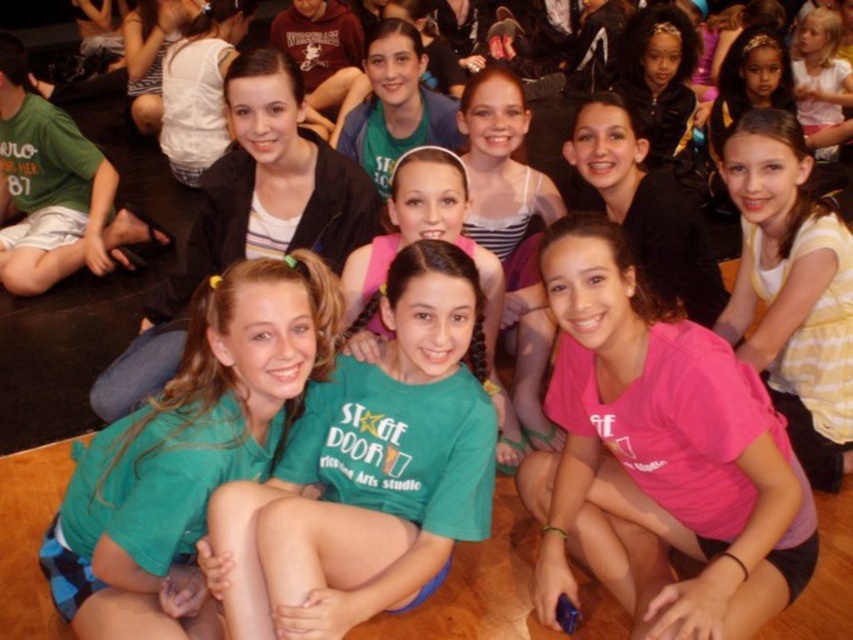
Question: Considering the real-world distances, which object is farthest from the pink matte shirt at lower right?

Choices:
 (A) green matte shirt at center
 (B) green fabric shirt at center

Answer: (B)

Question: Is pink matte shirt at lower right above green fabric shirt at center?

Choices:
 (A) yes
 (B) no

Answer: (A)

Question: Which point is closer to the camera?

Choices:
 (A) click(x=701, y=605)
 (B) click(x=456, y=432)

Answer: (A)

Question: Does green matte shirt at center have a greater width compared to green fabric shirt at center?

Choices:
 (A) yes
 (B) no

Answer: (B)

Question: Does green matte shirt at center lie behind green fabric shirt at center?

Choices:
 (A) yes
 (B) no

Answer: (B)

Question: Which of the following is the closest to the observer?

Choices:
 (A) (357, 483)
 (B) (97, 490)
 (C) (566, 396)

Answer: (B)